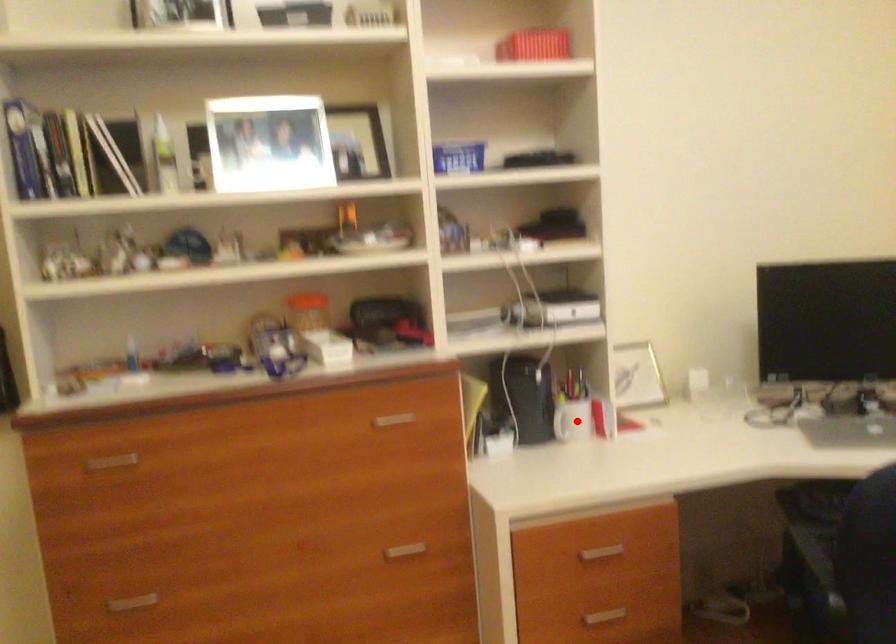
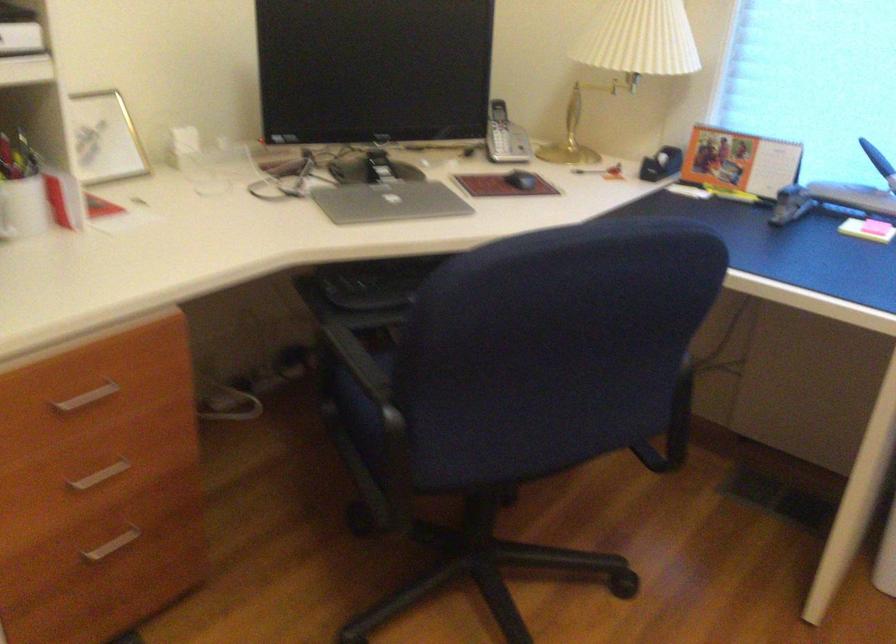
Where in the second image is the point corresponding to the highlighted location from the first image?

(23, 207)